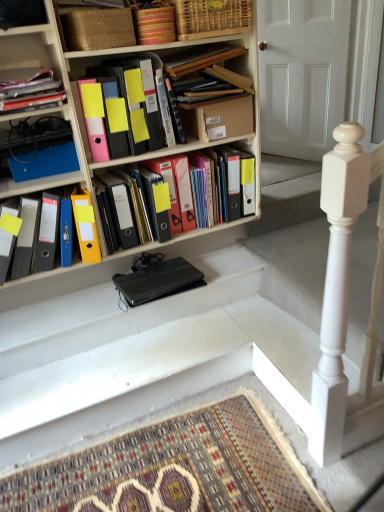
Question: In terms of width, does yellow matte folder at center, which appears as the 4th book when viewed from the top, look wider or thinner when compared to matte plastic folders at left, which appears as the 5th book when viewed from the top?

Choices:
 (A) thin
 (B) wide

Answer: (A)

Question: Is yellow matte folder at center, which appears as the 4th book when viewed from the top, inside or outside of matte plastic folders at left, which appears as the 5th book when viewed from the top?

Choices:
 (A) outside
 (B) inside

Answer: (A)

Question: Considering the real-world distances, which object is closest to the blue matte folder at left?

Choices:
 (A) patterned carpet at bottom
 (B) cardboard box at upper center
 (C) white wooden door at upper center
 (D) black matte laptop at center
 (E) matte plastic folders at left, the 1th book in the bottom-to-top sequence

Answer: (E)

Question: Based on their relative distances, which object is nearer to the black matte laptop at center?

Choices:
 (A) woven brown basket at upper center, marked as the second basket in a right-to-left arrangement
 (B) matte yellow folder at center, which appears as the second book when viewed from the top
 (C) yellow matte folder at center, which appears as the 4th book when viewed from the top
 (D) cardboard box at upper center
 (E) woven bamboo basket at upper center, arranged as the 2th basket when viewed from the left

Answer: (C)